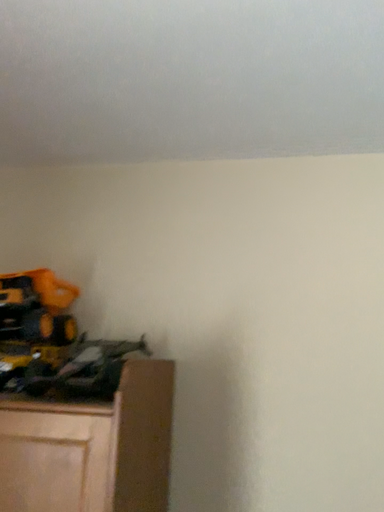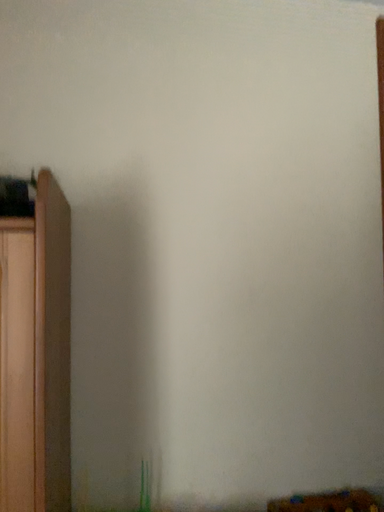
Question: Which way did the camera rotate in the video?

Choices:
 (A) rotated left
 (B) rotated right

Answer: (B)